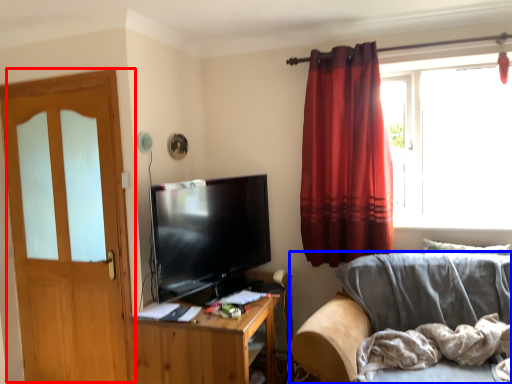
Question: Which of the following is the farthest to the observer, door (highlighted by a red box) or studio couch (highlighted by a blue box)?

Choices:
 (A) door
 (B) studio couch

Answer: (A)